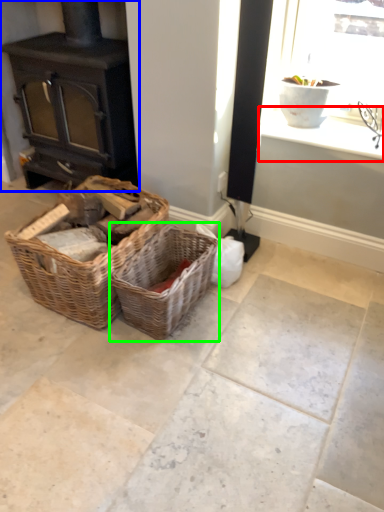
Question: Which object is the closest to the window sill (highlighted by a red box)? Choose among these: wood burning stove (highlighted by a blue box) or picnic basket (highlighted by a green box).

Choices:
 (A) wood burning stove
 (B) picnic basket

Answer: (B)